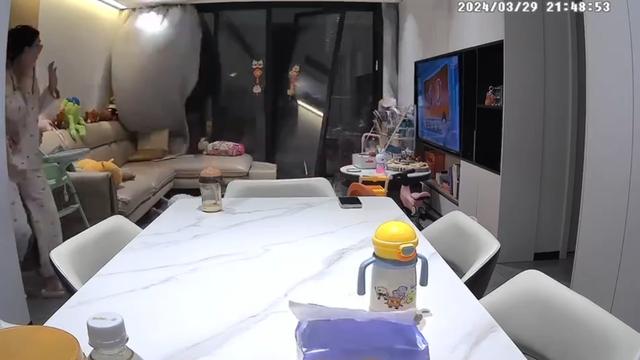
Where is `wall`? This screenshot has height=360, width=640. wall is located at coordinates (445, 22), (72, 43).